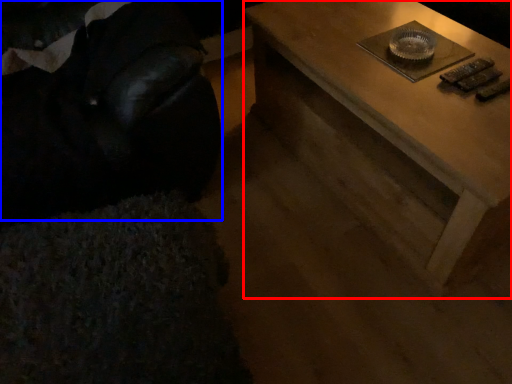
Question: Which of the following is the closest to the observer, table (highlighted by a red box) or bean bag chair (highlighted by a blue box)?

Choices:
 (A) table
 (B) bean bag chair

Answer: (B)